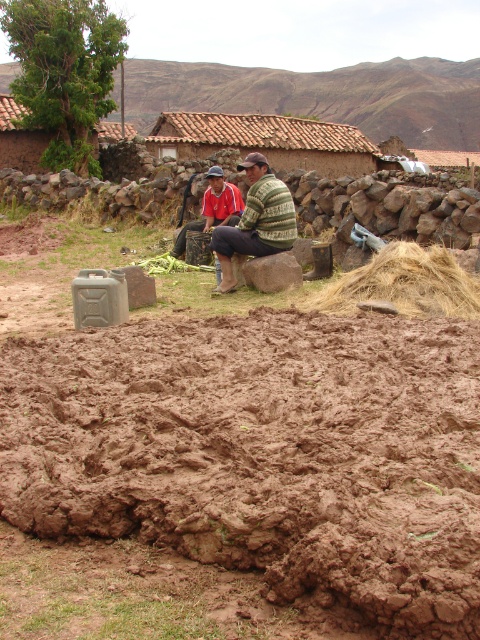
Can you confirm if golden straw at right is thinner than red fabric squat at center?

No.

Which is above, golden straw at right or red fabric squat at center?

Positioned higher is red fabric squat at center.

Does point (393, 257) come closer to viewer compared to point (228, 214)?

Yes.

Where is `golden straw at right`? The width and height of the screenshot is (480, 640). golden straw at right is located at coordinates (406, 284).

From the picture: Is brown muddy field at center below red fabric squat at center?

Yes.

Does brown muddy field at center appear on the right side of red fabric squat at center?

Correct, you'll find brown muddy field at center to the right of red fabric squat at center.

Is point (32, 356) more distant than point (215, 186)?

No.

Where is `brown muddy field at center`? The height and width of the screenshot is (640, 480). brown muddy field at center is located at coordinates (230, 454).

How much distance is there between brown muddy field at center and green knitted sweater at center?

5.35 meters

Between brown muddy field at center and green knitted sweater at center, which one has more height?

With more height is green knitted sweater at center.

Find the location of `brown muddy field at center`. brown muddy field at center is located at coordinates 230,454.

Find the location of a particular element. The image size is (480, 640). brown muddy field at center is located at coordinates tap(230, 454).